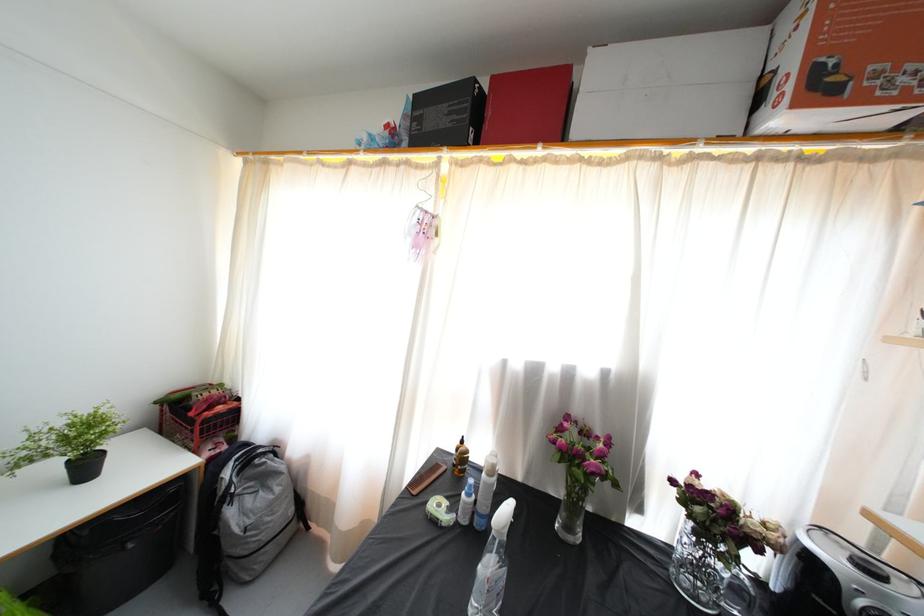
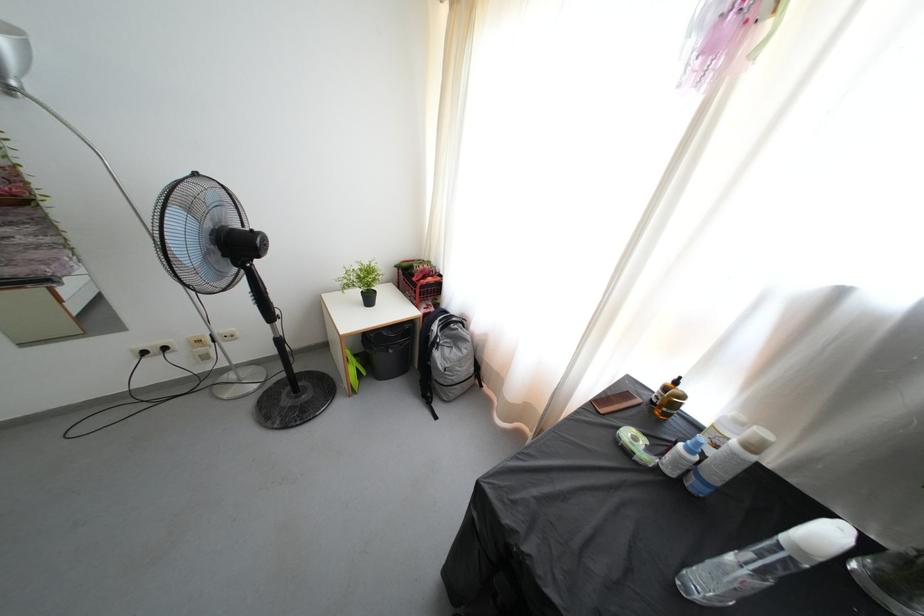
Locate, in the second image, the point that corresponds to [442,472] in the first image.

(633, 400)